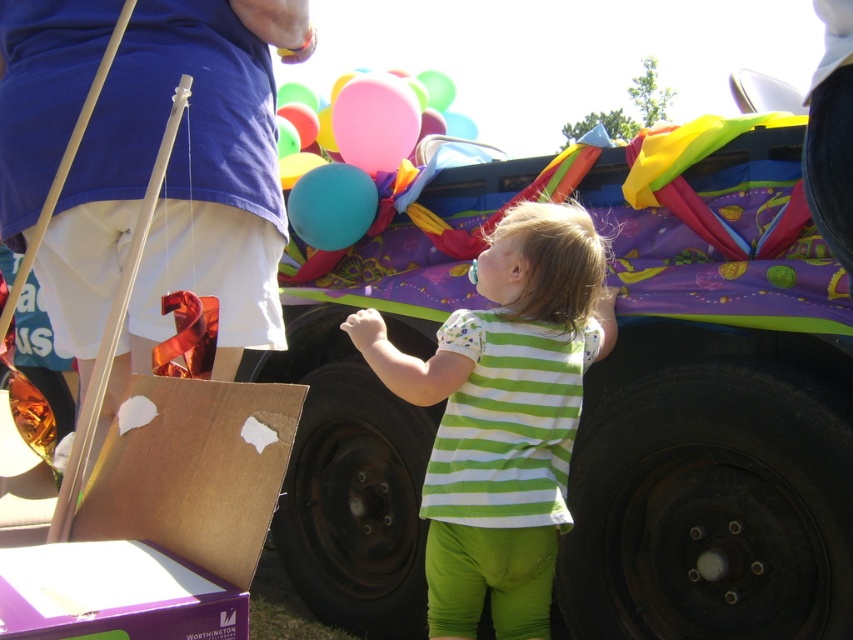
Based on the photo, you are a photographer trying to capture a clear photo of the pink rubber balloon at upper center without the green striped shirt at center blocking it. Given their sizes, is it possible to adjust your position to achieve this?

The green striped shirt at center is wider than the pink rubber balloon at upper center. By moving to the side, you can position yourself so the narrower pink rubber balloon at upper center is no longer obscured by the wider green striped shirt at center.

You are a delivery person who needs to place a new package on the brown cardboard box at lower left. However, there is a matte blue balloon at upper center nearby. Can you safely place the package on the box without the balloon obstructing the space?

The brown cardboard box at lower left is not as tall as the matte blue balloon at upper center, so the balloon is taller. Since the balloon is taller, placing the package on the box might not be obstructed by the balloon in terms of height. However, the balloon is at upper center, so it might be above the box, but since the box is at lower left, the balloon might not block the placement area. The height difference doesn not directly affect the vertical space for placing the package, so it should be safe.

You are a photographer at the event and want to capture both the green striped shirt at center and the pink rubber balloon at upper center in the same frame. Considering their sizes, which object should you focus on to ensure both are clearly visible?

The green striped shirt at center is larger in size than the pink rubber balloon at upper center, so focusing on the green striped shirt at center would help ensure both are clearly visible in the frame.